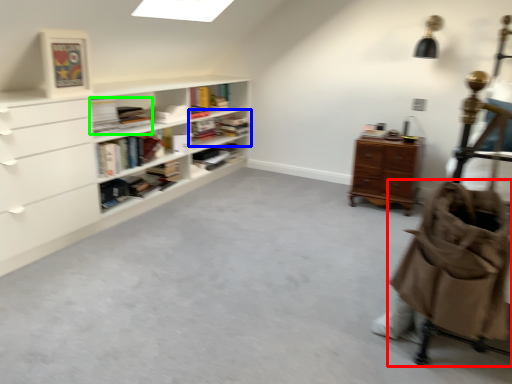
Question: Considering the real-world distances, which object is closest to baby carriage (highlighted by a red box)? shelf (highlighted by a blue box) or book (highlighted by a green box).

Choices:
 (A) shelf
 (B) book

Answer: (B)